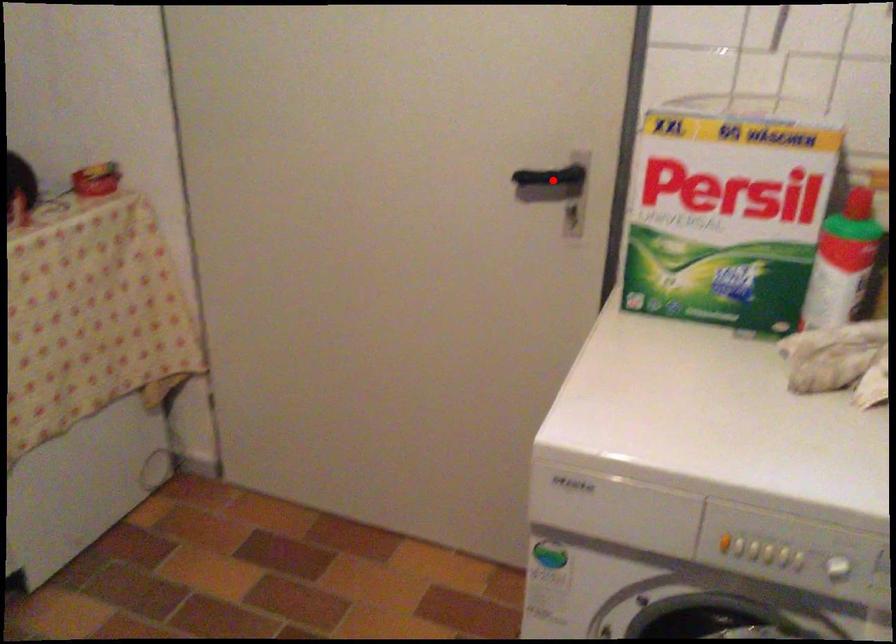
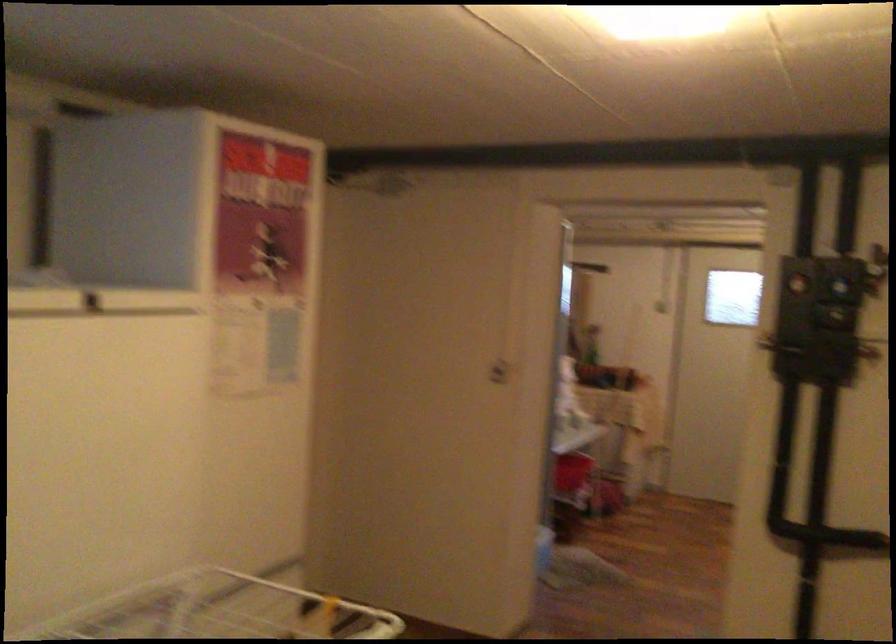
Question: I am providing you with two images of the same scene from different viewpoints. A red point is marked on the first image. Can you still see the location of the red point in image 2?

Choices:
 (A) Yes
 (B) No

Answer: (B)